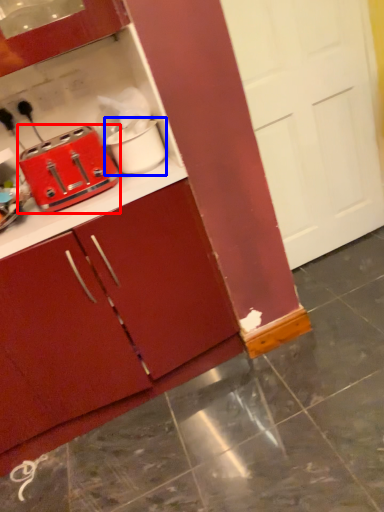
Question: Which object appears farthest to the camera in this image, toaster (highlighted by a red box) or appliance (highlighted by a blue box)?

Choices:
 (A) toaster
 (B) appliance

Answer: (B)